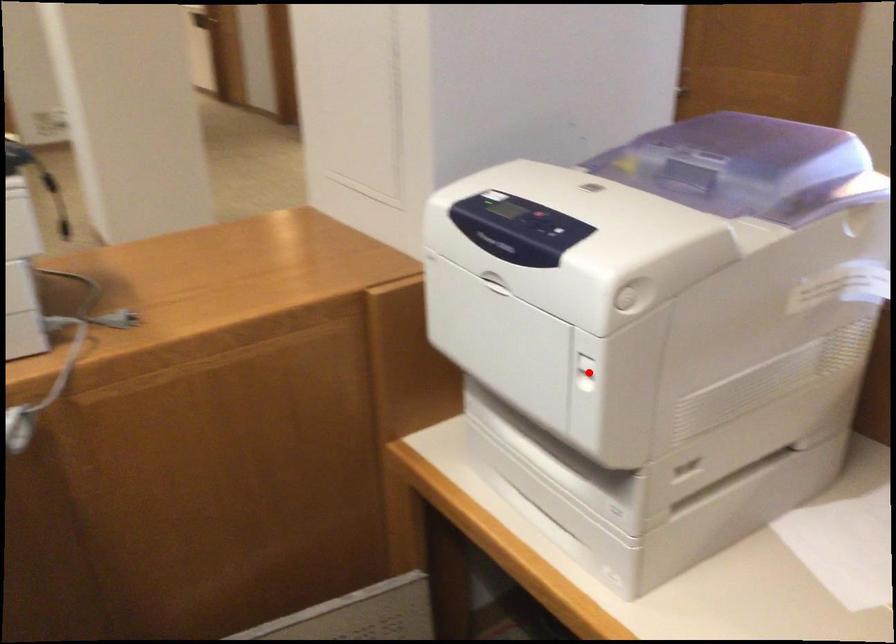
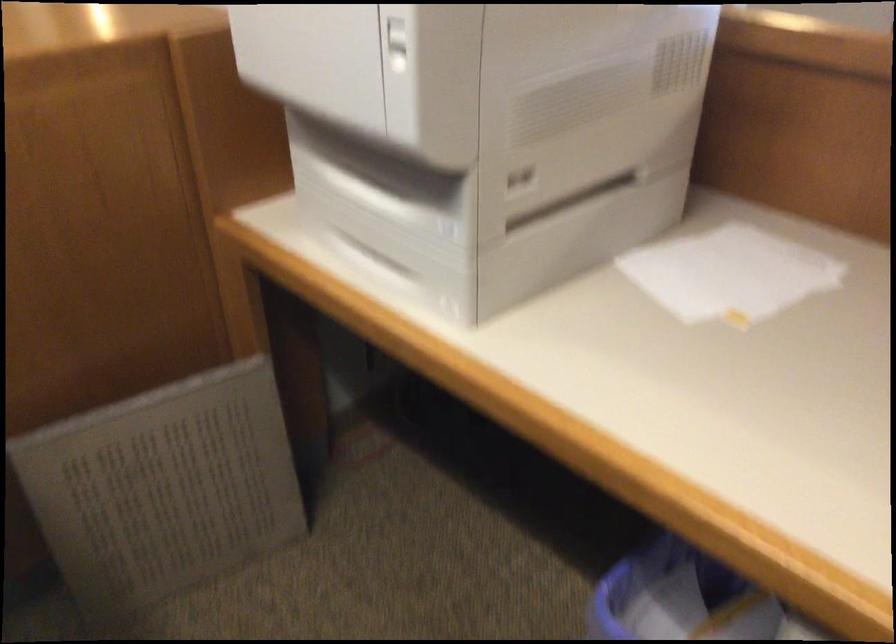
Find the pixel in the second image that matches the highlighted location in the first image.

(397, 44)